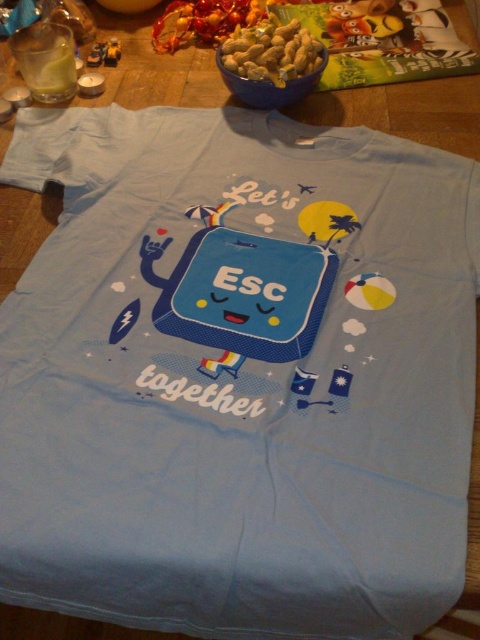
Question: Which is nearer to the smooth brown cereal at upper center?

Choices:
 (A) shiny plastic toy at upper center
 (B) yellow plastic toy at upper left

Answer: (A)

Question: Which point is closer to the camera taking this photo?

Choices:
 (A) (359, 45)
 (B) (265, 24)
 (C) (108, 49)
 (D) (172, 10)

Answer: (B)

Question: Is cartoonish plastic toy at upper center to the left of yellow plastic toy at upper left from the viewer's perspective?

Choices:
 (A) no
 (B) yes

Answer: (A)

Question: Is smooth brown cereal at upper center wider than yellow plastic toy at upper left?

Choices:
 (A) yes
 (B) no

Answer: (A)

Question: Which object is farther from the camera taking this photo?

Choices:
 (A) smooth brown cereal at upper center
 (B) yellow plastic toy at upper left

Answer: (B)

Question: Is shiny plastic toy at upper center positioned at the back of cartoonish plastic toy at upper center?

Choices:
 (A) no
 (B) yes

Answer: (B)